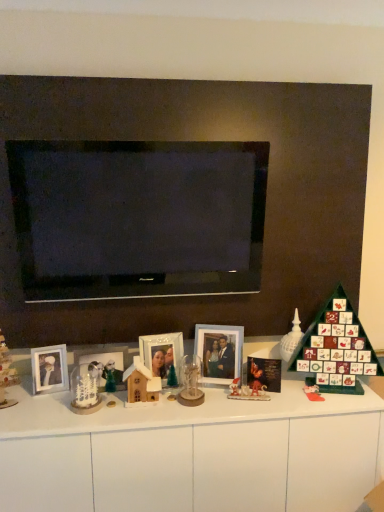
At what (x,y) coordinates should I click in order to perform the action: click on vacant space in front of matte plastic toy at right, the first toy positioned from the right. Please return your answer as a coordinate pair (x, y). The image size is (384, 512). Looking at the image, I should click on (317, 404).